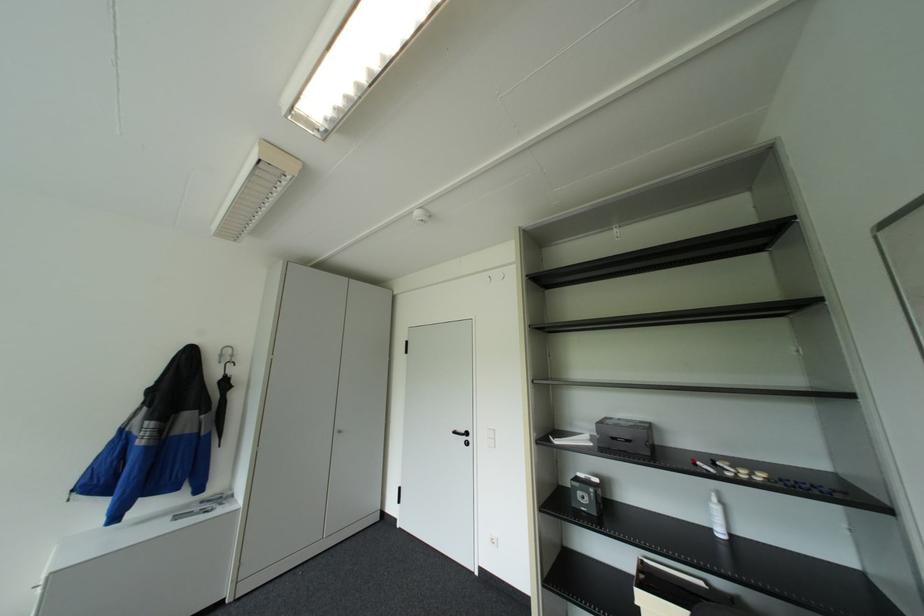
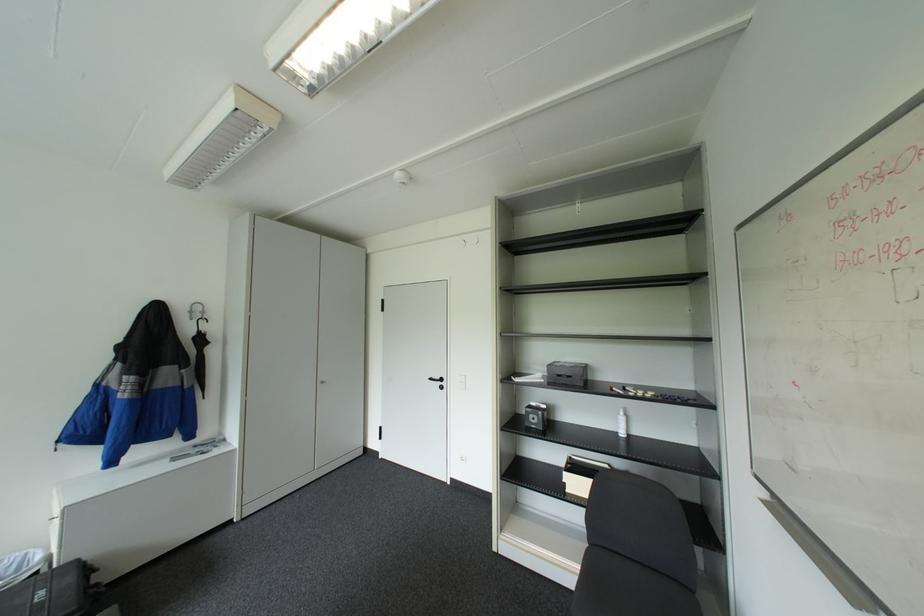
Find the pixel in the second image that matches point (600, 443) in the first image.

(551, 379)